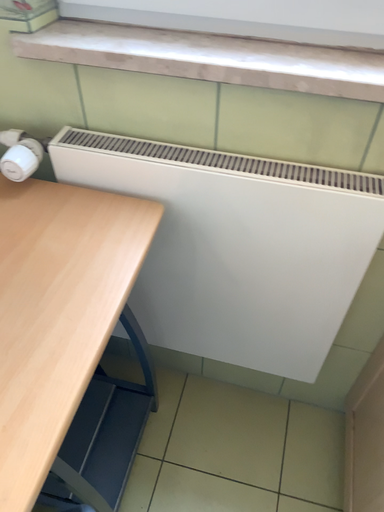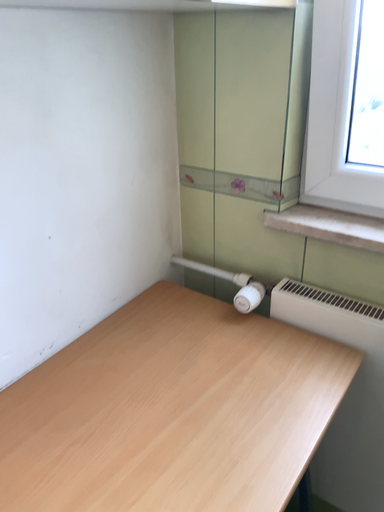
Question: How did the camera likely rotate when shooting the video?

Choices:
 (A) rotated left
 (B) rotated right

Answer: (A)